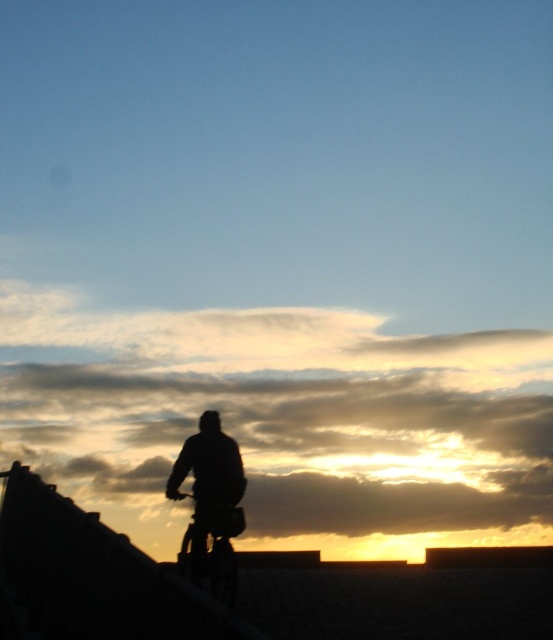
Question: Is the position of silhouette fabric at center more distant than that of metallic silver bicycle at center?

Choices:
 (A) no
 (B) yes

Answer: (A)

Question: Is silhouette fabric at center bigger than metallic silver bicycle at center?

Choices:
 (A) yes
 (B) no

Answer: (B)

Question: Which point appears farthest from the camera in this image?

Choices:
 (A) (231, 493)
 (B) (184, 497)

Answer: (A)

Question: Is silhouette fabric at center positioned before metallic silver bicycle at center?

Choices:
 (A) no
 (B) yes

Answer: (B)

Question: Which point appears farthest from the camera in this image?

Choices:
 (A) (202, 564)
 (B) (213, 492)

Answer: (A)